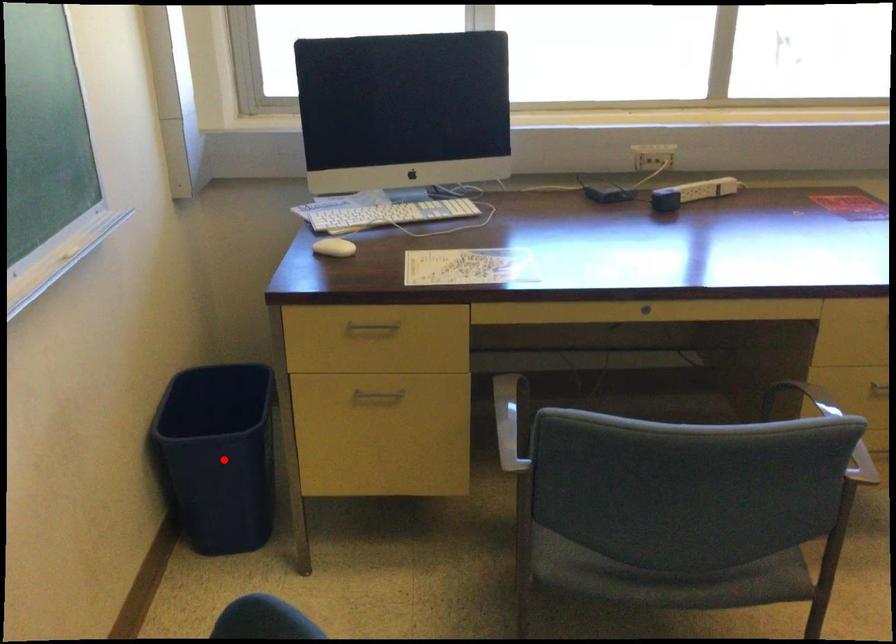
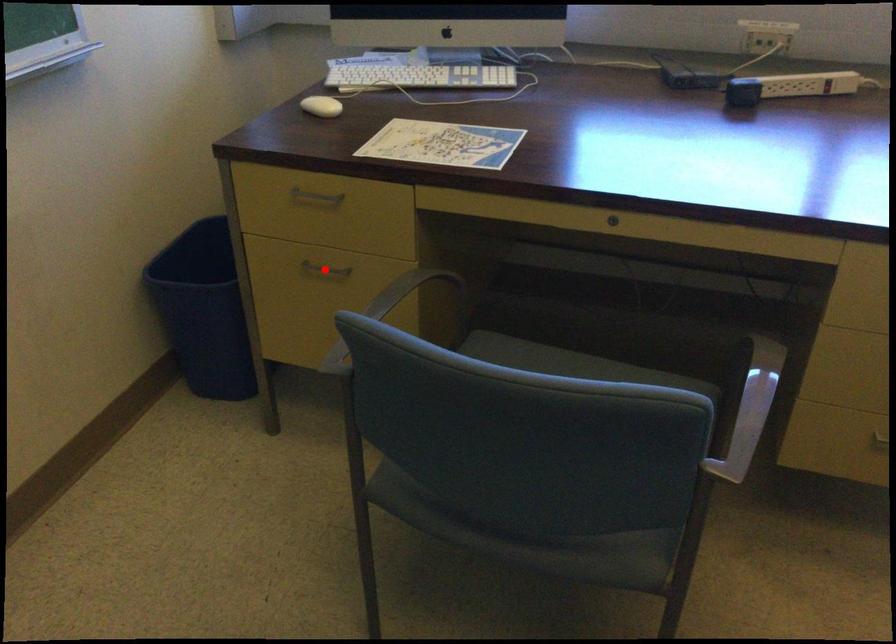
I am providing you with two images of the same scene from different viewpoints. A red point is marked on the first image and another point is marked on the second image. Is the red point in image1 aligned with the point shown in image2?

No